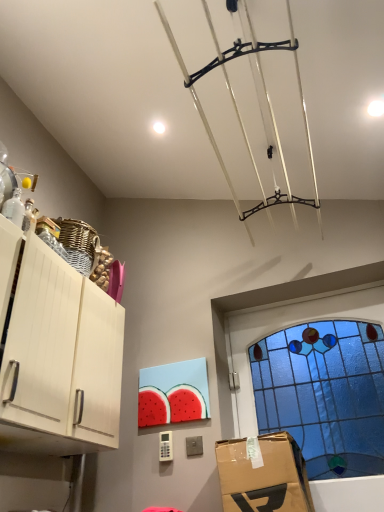
Question: From their relative heights in the image, would you say transparent glass bottles at left is taller or shorter than white matte cabinet at left?

Choices:
 (A) short
 (B) tall

Answer: (A)

Question: Considering the positions of transparent glass bottles at left and white matte cabinet at left in the image, is transparent glass bottles at left bigger or smaller than white matte cabinet at left?

Choices:
 (A) big
 (B) small

Answer: (B)

Question: Which object is the farthest from the blue stained glass window at upper right?

Choices:
 (A) transparent glass bottles at left
 (B) white matte cabinet at left

Answer: (A)

Question: Which object is the farthest from the blue stained glass window at upper right?

Choices:
 (A) transparent glass bottles at left
 (B) white matte cabinet at left

Answer: (A)